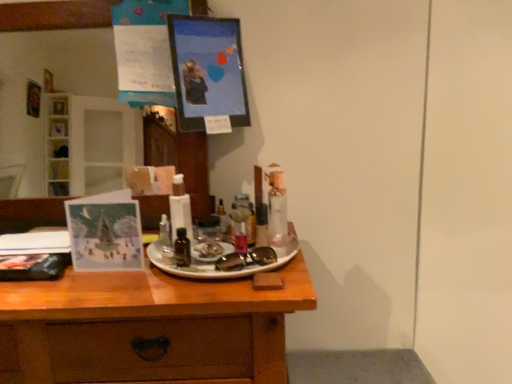
Identify the location of free space in front of metallic silver spray can at center, which ranks as the 2th toiletry in front-to-back order. pos(252,278).